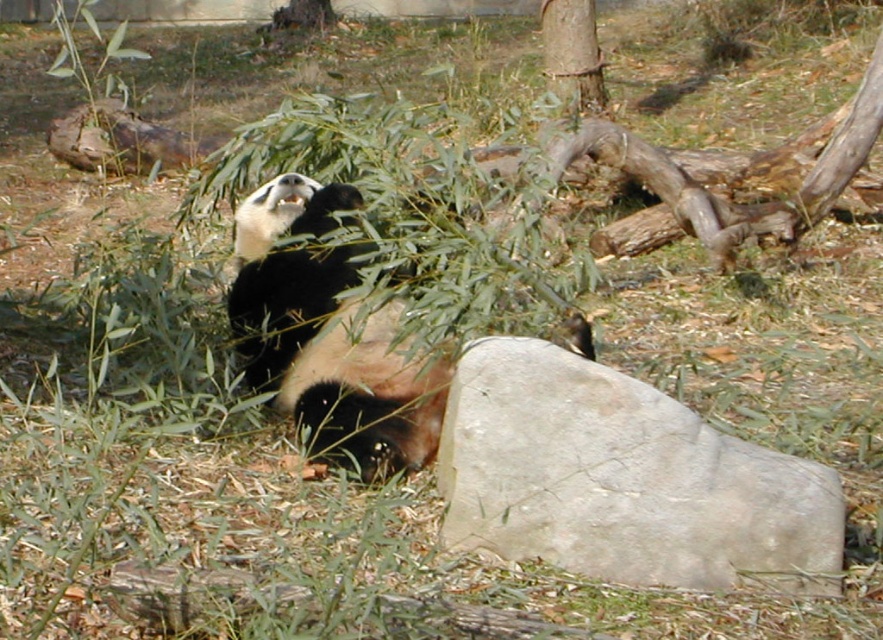
Which is behind, point (593, 486) or point (239, 300)?

Positioned behind is point (239, 300).

Is gray rock at center bigger than black fur panda at center?

No, gray rock at center is not bigger than black fur panda at center.

Between point (493, 532) and point (300, 211), which one is positioned in front?

Point (493, 532) is more forward.

Image resolution: width=883 pixels, height=640 pixels. In order to click on gray rock at center in this screenshot , I will do `click(623, 481)`.

From the picture: Can you confirm if gray rock at center is positioned to the left of smooth brown tree trunk at upper center?

Correct, you'll find gray rock at center to the left of smooth brown tree trunk at upper center.

What do you see at coordinates (623, 481) in the screenshot? I see `gray rock at center` at bounding box center [623, 481].

Identify the location of gray rock at center. (623, 481).

Can you confirm if black fur panda at center is bigger than smooth brown tree trunk at upper center?

Yes, black fur panda at center is bigger than smooth brown tree trunk at upper center.

Is black fur panda at center positioned at the back of smooth brown tree trunk at upper center?

No, black fur panda at center is closer to the viewer.

Identify the location of black fur panda at center. The width and height of the screenshot is (883, 640). (328, 339).